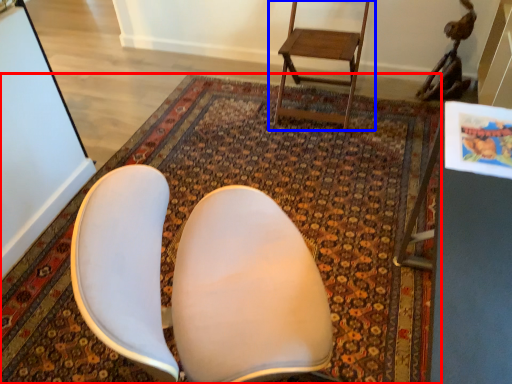
Question: Which of the following is the closest to the observer, mat (highlighted by a red box) or chair (highlighted by a blue box)?

Choices:
 (A) mat
 (B) chair

Answer: (A)